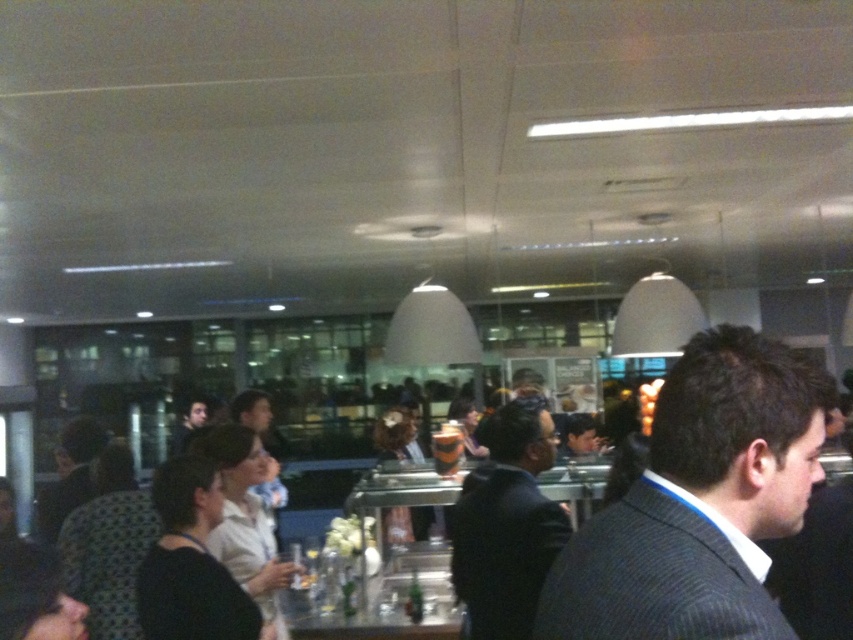
Question: Can you confirm if dark gray suit at center is positioned to the right of black suit at center?

Choices:
 (A) no
 (B) yes

Answer: (B)

Question: Considering the real-world distances, which object is closest to the gray pinstripe suit at center?

Choices:
 (A) dark gray suit at center
 (B) clear glass table at center
 (C) black suit at center

Answer: (A)

Question: Does black suit at center lie in front of clear glass table at center?

Choices:
 (A) no
 (B) yes

Answer: (B)

Question: Which point is closer to the camera taking this photo?

Choices:
 (A) (523, 522)
 (B) (695, 556)
 (C) (821, 476)
 (D) (447, 557)

Answer: (B)

Question: In this image, where is dark gray suit at center located relative to gray pinstripe suit at center?

Choices:
 (A) right
 (B) left

Answer: (A)

Question: Which point is closer to the camera taking this photo?

Choices:
 (A) click(x=389, y=588)
 (B) click(x=523, y=444)
 (C) click(x=724, y=627)

Answer: (C)